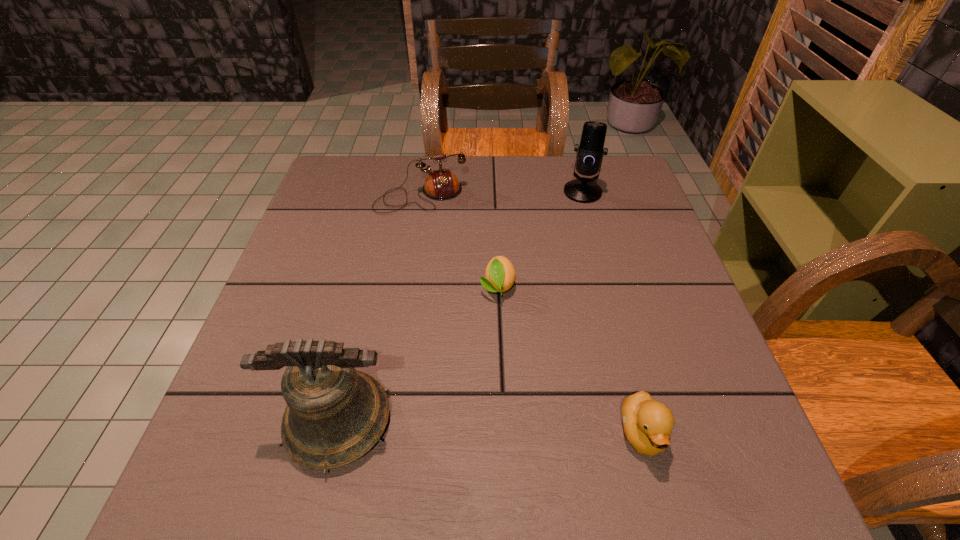
Locate an element on the screen. This screenshot has width=960, height=540. bell is located at coordinates (335, 414).

Identify the location of duckling. pyautogui.click(x=647, y=423).

In order to click on the shortest object in this screenshot , I will do `click(500, 274)`.

Locate an element on the screen. The width and height of the screenshot is (960, 540). the third object from left to right is located at coordinates (500, 274).

Where is `microphone`? This screenshot has height=540, width=960. microphone is located at coordinates (590, 152).

What are the coordinates of `telephone` in the screenshot? It's located at (442, 184).

Identify the location of free space located 0.110m on the left of the bell. (219, 421).

Image resolution: width=960 pixels, height=540 pixels. I want to click on blank space located with leaves positioned above the third object from left to right, so click(x=499, y=324).

This screenshot has width=960, height=540. What are the coordinates of `free space located with leaves positioned above the third object from left to right` in the screenshot? It's located at (503, 389).

The height and width of the screenshot is (540, 960). Find the location of `free space located 0.180m with leaves positioned above the third object from left to right`. free space located 0.180m with leaves positioned above the third object from left to right is located at coordinates (502, 380).